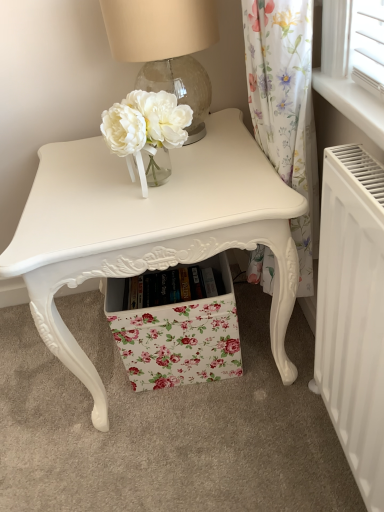
Find the location of a particular element. Image resolution: width=384 pixels, height=512 pixels. vacant space situated on the left part of white matte radiator at lower right is located at coordinates (264, 454).